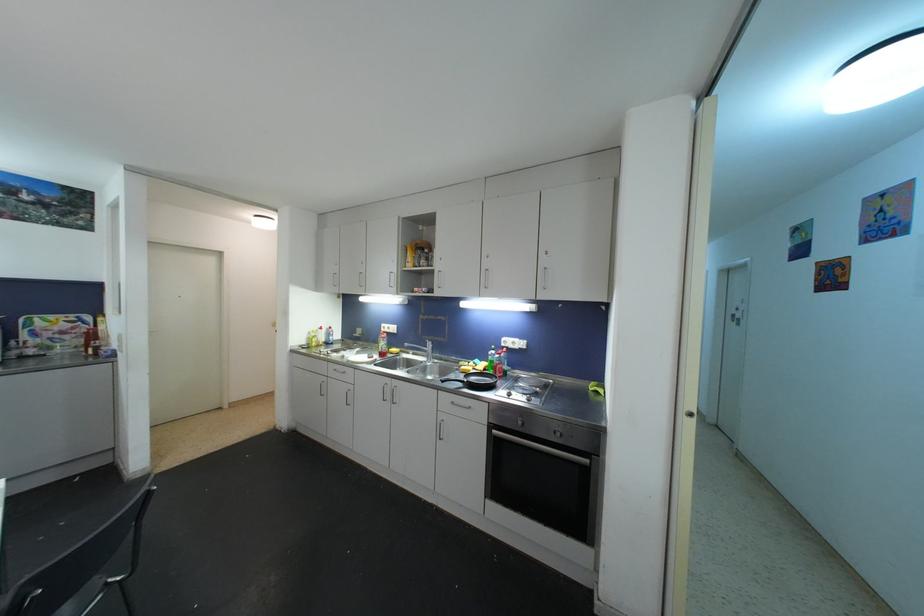
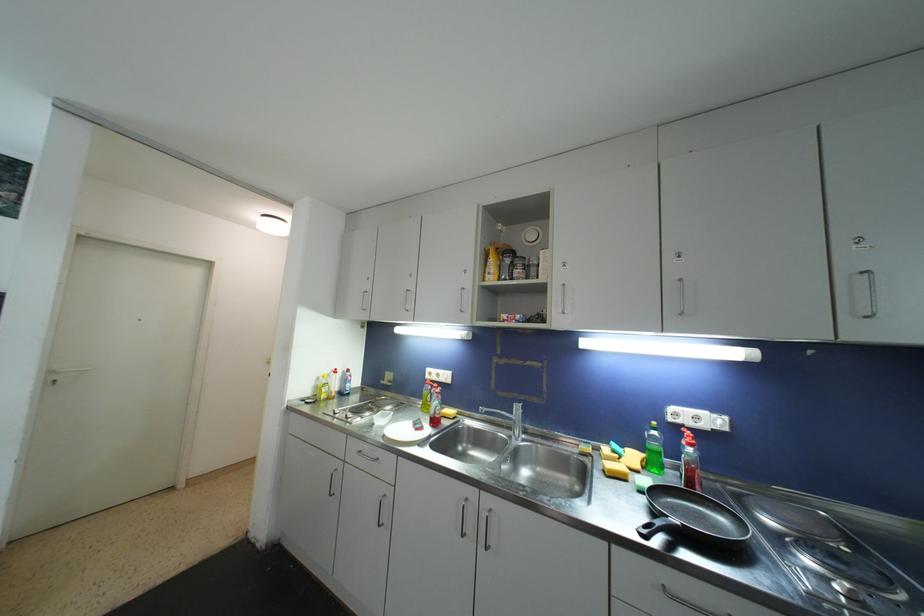
What movement of the cameraman would produce the second image?

The cameraman walked toward left, forward.